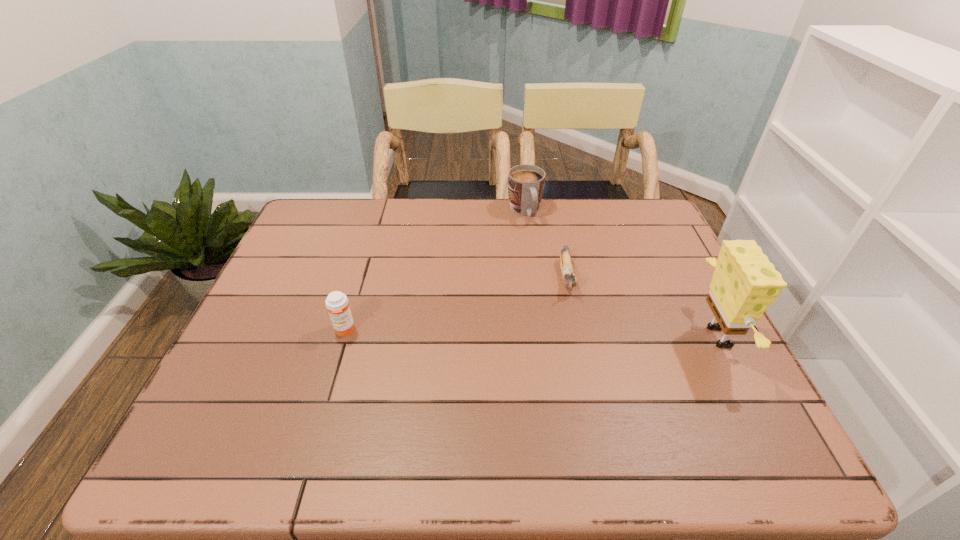
You are a GUI agent. You are given a task and a screenshot of the screen. Output one action in this format:
    pyautogui.click(x=<x>, y=<y>)
    Task: Click on the free point located on the side of the mug with the handle
    This screenshot has height=540, width=960.
    Given the screenshot: What is the action you would take?
    pyautogui.click(x=557, y=284)

Find the location of a particular element. The height and width of the screenshot is (540, 960). free location located 0.120m on the peel of the third object from left to right is located at coordinates (577, 334).

Find the location of `free space located 0.260m on the peel of the third object from left to right`. free space located 0.260m on the peel of the third object from left to right is located at coordinates (585, 383).

Where is `vacant space situated on the peel of the third object from left to right`? This screenshot has width=960, height=540. vacant space situated on the peel of the third object from left to right is located at coordinates (590, 417).

Find the location of a particular element. object located at the far edge is located at coordinates (526, 183).

At what (x,y) coordinates should I click in order to perform the action: click on object present at the near edge. Please return your answer as a coordinate pair (x, y). The image size is (960, 540). Looking at the image, I should click on (744, 283).

The height and width of the screenshot is (540, 960). In order to click on object located at the right edge in this screenshot , I will do `click(744, 283)`.

Find the location of a particular element. The height and width of the screenshot is (540, 960). object situated at the near right corner is located at coordinates (744, 283).

The width and height of the screenshot is (960, 540). In order to click on vacant space at the far edge in this screenshot , I will do 490,213.

Where is `vacant space at the near edge`? vacant space at the near edge is located at coordinates (592, 402).